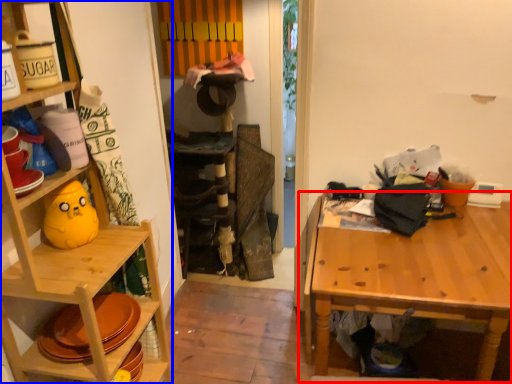
Question: Which point is further to the camera, table (highlighted by a red box) or shelf (highlighted by a blue box)?

Choices:
 (A) table
 (B) shelf

Answer: (A)